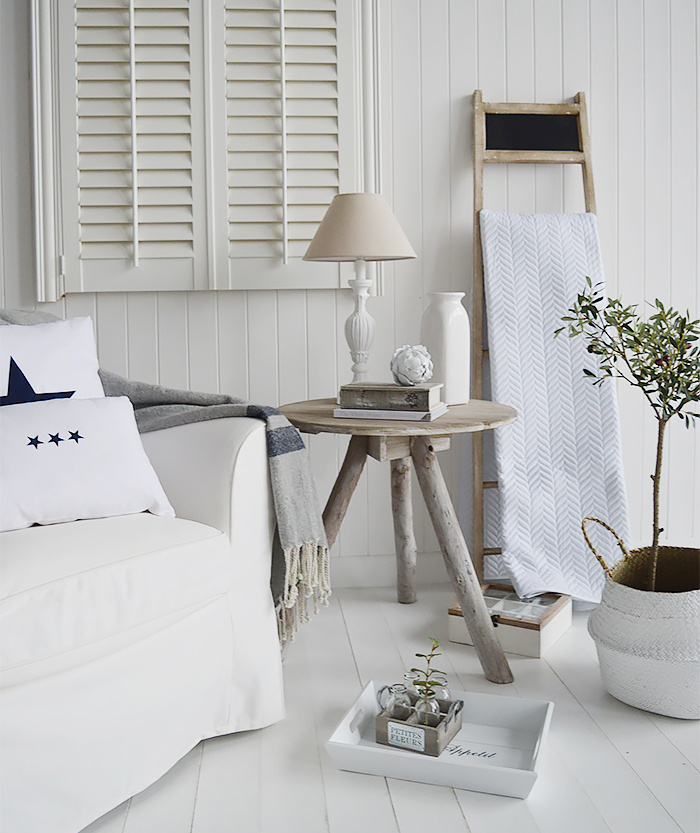
The width and height of the screenshot is (700, 833). I want to click on pillows, so click(75, 447), click(29, 377).